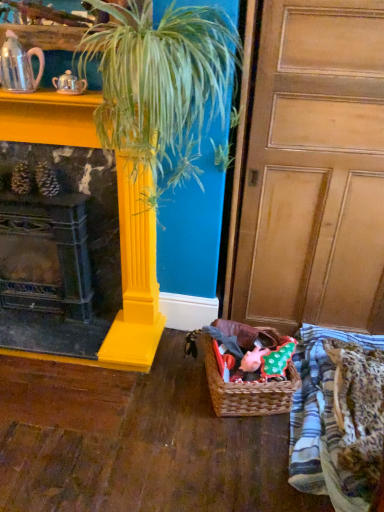
Question: In terms of size, does wooden at right appear bigger or smaller than matte yellow fireplace at left?

Choices:
 (A) big
 (B) small

Answer: (A)

Question: Is point (256, 294) closer or farther from the camera than point (51, 115)?

Choices:
 (A) farther
 (B) closer

Answer: (A)

Question: Based on their relative distances, which object is farther from the brown woven basket at lower right?

Choices:
 (A) wooden at right
 (B) yellow glossy column at center
 (C) shiny silver teapot at upper left, the second tea pot viewed from the right
 (D) fluffy leopard print blanket at lower right
 (E) pink glossy teapot at upper left, the second tea pot in the left-to-right sequence

Answer: (C)

Question: Which is nearer to the fluffy leopard print blanket at lower right?

Choices:
 (A) matte yellow fireplace at left
 (B) yellow glossy column at center
 (C) brown woven basket at lower right
 (D) pink glossy teapot at upper left, the second tea pot in the left-to-right sequence
 (E) wooden at right

Answer: (C)